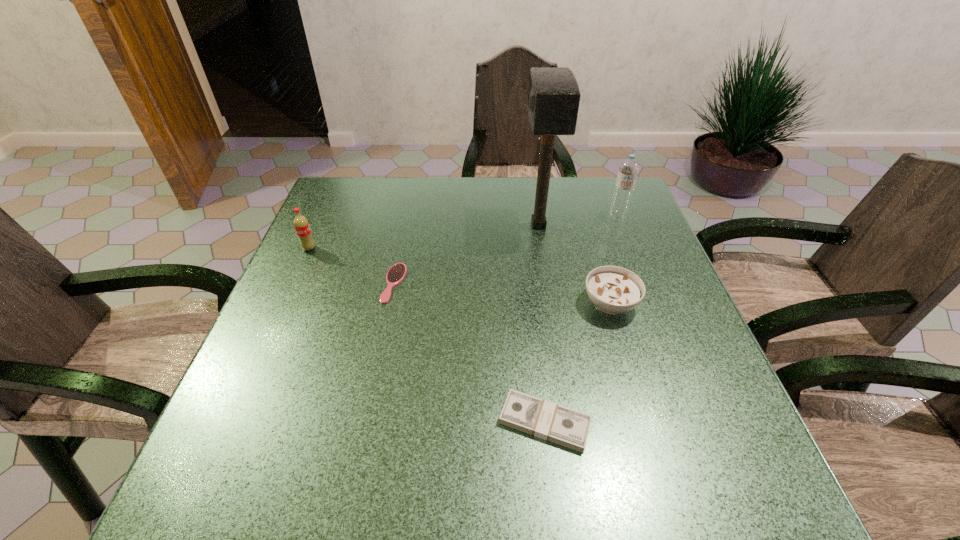
This screenshot has width=960, height=540. I want to click on vacant point located between the leftmost object and the fifth shortest object, so click(463, 232).

The height and width of the screenshot is (540, 960). In order to click on free spot between the water bottle and the fifth object from right to left in this screenshot , I will do `click(506, 249)`.

I want to click on free space between the third shortest object and the soda, so click(x=460, y=276).

At what (x,y) coordinates should I click in order to perform the action: click on blank region between the nearest object and the hairbrush. Please return your answer as a coordinate pair (x, y). Image resolution: width=960 pixels, height=540 pixels. Looking at the image, I should click on (469, 353).

Image resolution: width=960 pixels, height=540 pixels. I want to click on free space between the hairbrush and the soda, so click(351, 266).

The width and height of the screenshot is (960, 540). What are the coordinates of `free area in between the water bottle and the soup bowl` in the screenshot? It's located at (613, 260).

Where is `object that stands as the fifth closest to the mallet`? This screenshot has width=960, height=540. object that stands as the fifth closest to the mallet is located at coordinates (301, 224).

Identify which object is the closest to the fifth object from right to left. Please provide its 2D coordinates. Your answer should be formatted as a tuple, i.e. [(x, y)], where the tuple contains the x and y coordinates of a point satisfying the conditions above.

[(301, 224)]

Identify the location of vacant region that satisfies the following two spatial constraints: 1. on the back side of the rightmost object; 2. on the left side of the fifth object from right to left. This screenshot has width=960, height=540. (408, 216).

Where is `vacant space that satisfies the following two spatial constraints: 1. on the back side of the dollar; 2. on the left side of the mallet`? vacant space that satisfies the following two spatial constraints: 1. on the back side of the dollar; 2. on the left side of the mallet is located at coordinates (522, 225).